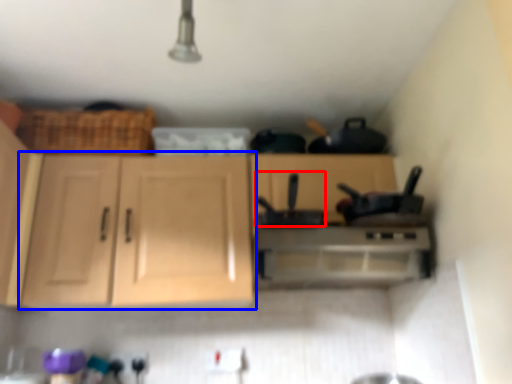
Question: Which point is further to the camera, appliance (highlighted by a red box) or cabinetry (highlighted by a blue box)?

Choices:
 (A) appliance
 (B) cabinetry

Answer: (B)